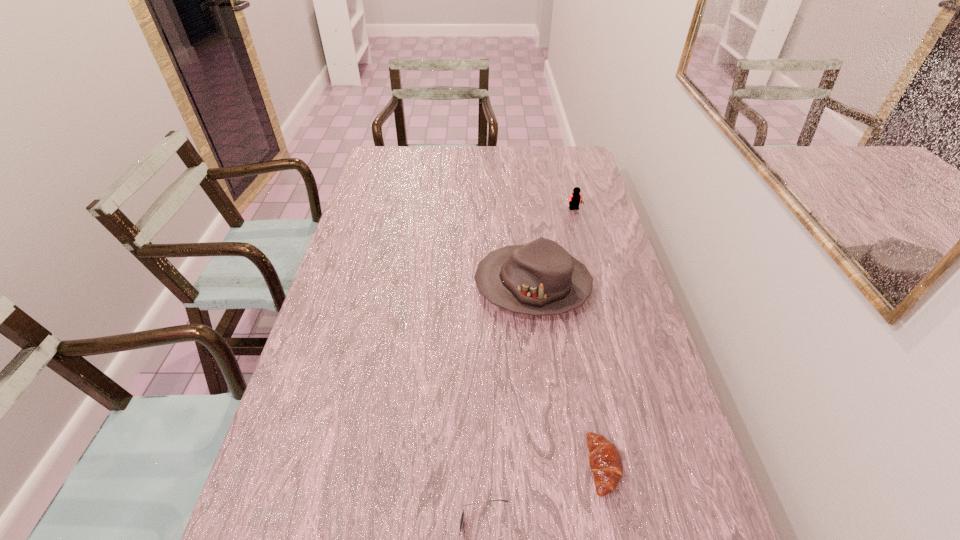
Locate an element on the screen. The height and width of the screenshot is (540, 960). vacant space located on the back of the crescent roll is located at coordinates (593, 411).

You are a GUI agent. You are given a task and a screenshot of the screen. Output one action in this format:
    pyautogui.click(x=<x>, y=<y>)
    Task: Click on the hat situated at the right edge
    
    Given the screenshot: What is the action you would take?
    pyautogui.click(x=540, y=278)

Where is `Lego at the right edge`? The height and width of the screenshot is (540, 960). Lego at the right edge is located at coordinates (575, 198).

Locate an element on the screen. This screenshot has width=960, height=540. crescent roll positioned at the right edge is located at coordinates (605, 460).

Identify the location of vacant space at the left edge. (351, 219).

The height and width of the screenshot is (540, 960). I want to click on blank area at the right edge, so click(x=590, y=213).

The width and height of the screenshot is (960, 540). In order to click on vacant space at the far left corner of the desktop in this screenshot , I will do `click(386, 161)`.

Locate an element on the screen. The width and height of the screenshot is (960, 540). vacant space at the far right corner of the desktop is located at coordinates (578, 167).

This screenshot has height=540, width=960. What are the coordinates of `vacant area between the third nearest object and the third farthest object` in the screenshot? It's located at (568, 375).

Identify the location of vacant area that lies between the third nearest object and the second nearest object. The image size is (960, 540). (568, 375).